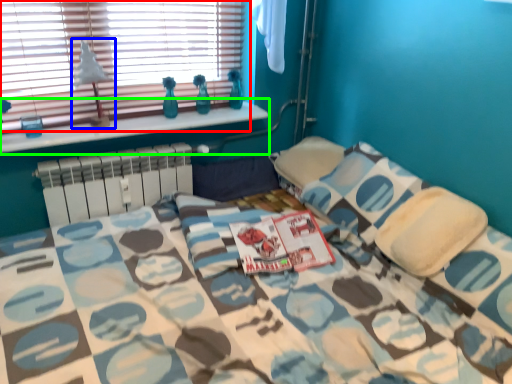
Question: Which object is the farthest from window (highlighted by a red box)? Choose among these: table lamp (highlighted by a blue box) or window sill (highlighted by a green box).

Choices:
 (A) table lamp
 (B) window sill

Answer: (B)